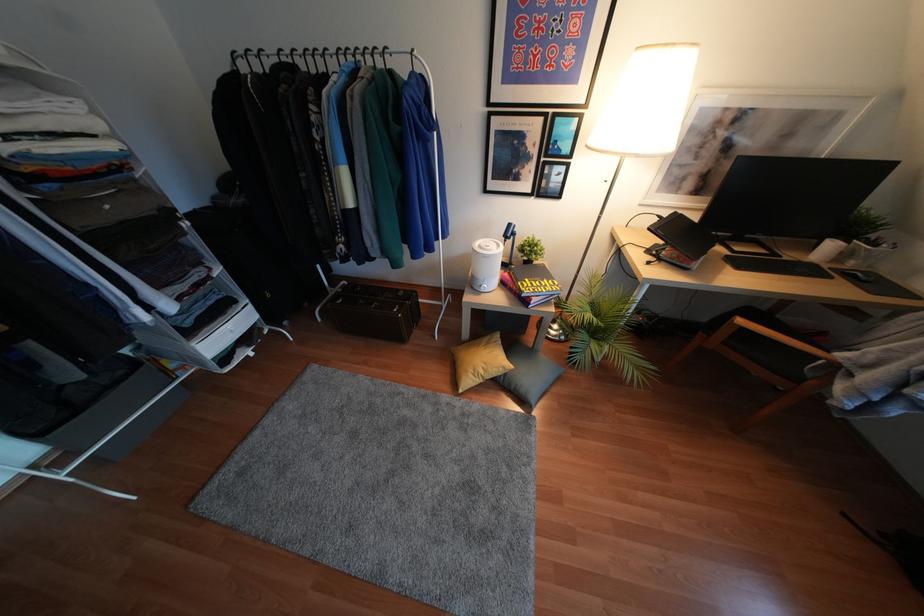
Describe the element at coordinates (383, 485) in the screenshot. This screenshot has width=924, height=616. I see `a gray floor cushion` at that location.